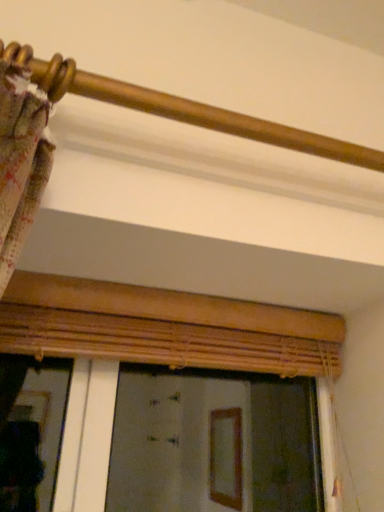
Question: Is wooden blinds at center bigger or smaller than gold polished rod at upper center?

Choices:
 (A) big
 (B) small

Answer: (A)

Question: Is wooden blinds at center to the left or to the right of gold polished rod at upper center in the image?

Choices:
 (A) right
 (B) left

Answer: (B)

Question: From the image's perspective, is wooden blinds at center located above or below gold polished rod at upper center?

Choices:
 (A) below
 (B) above

Answer: (A)

Question: In terms of width, does gold polished rod at upper center look wider or thinner when compared to wooden blinds at center?

Choices:
 (A) thin
 (B) wide

Answer: (A)

Question: Is point (21, 67) positioned closer to the camera than point (26, 326)?

Choices:
 (A) farther
 (B) closer

Answer: (B)

Question: From a real-world perspective, is gold polished rod at upper center above or below wooden blinds at center?

Choices:
 (A) above
 (B) below

Answer: (A)

Question: From the image's perspective, is gold polished rod at upper center above or below wooden blinds at center?

Choices:
 (A) below
 (B) above

Answer: (B)